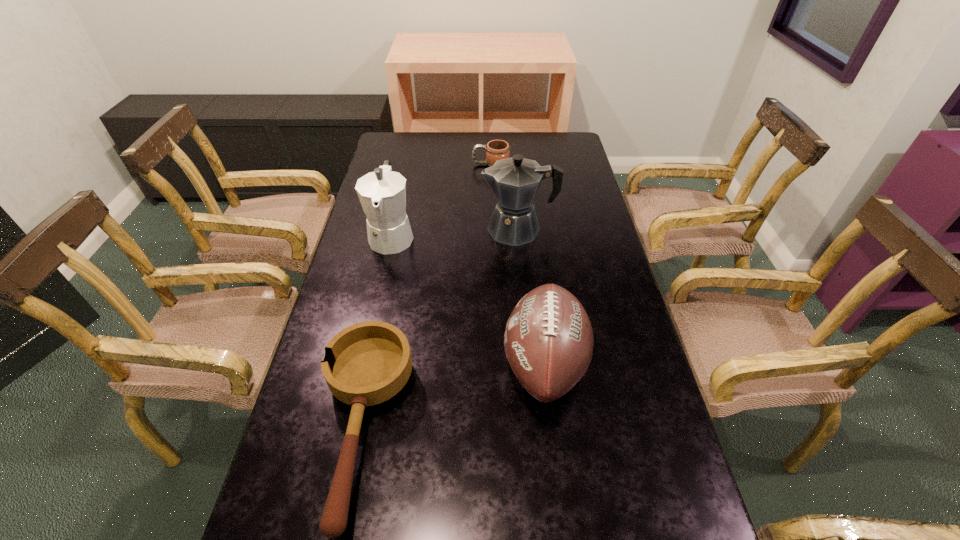
Where is `free space between the left coffeepot and the football (American)`? This screenshot has height=540, width=960. free space between the left coffeepot and the football (American) is located at coordinates (468, 299).

This screenshot has height=540, width=960. Identify the location of unoccupied position between the left coffeepot and the right coffeepot. (455, 232).

You are a GUI agent. You are given a task and a screenshot of the screen. Output one action in this format:
    pyautogui.click(x=<x>, y=<y>)
    Task: Click on the empty space between the right coffeepot and the left coffeepot
    Image resolution: width=960 pixels, height=540 pixels.
    Given the screenshot: What is the action you would take?
    (x=455, y=232)

Where is `free space between the left coffeepot and the farthest object`? free space between the left coffeepot and the farthest object is located at coordinates (442, 200).

Locate an element on the screen. This screenshot has height=540, width=960. object that can be found as the third closest to the left coffeepot is located at coordinates (496, 150).

Point out which object is positioned as the nearest to the right coffeepot. Please provide its 2D coordinates. Your answer should be formatted as a tuple, i.e. [(x, y)], where the tuple contains the x and y coordinates of a point satisfying the conditions above.

[(382, 193)]

Identify the location of free region that satisfies the following two spatial constraints: 1. at the spout of the right coffeepot; 2. at the spout of the left coffeepot. (518, 235).

The width and height of the screenshot is (960, 540). Identify the location of free location that satisfies the following two spatial constraints: 1. on the back side of the football (American); 2. at the spout of the right coffeepot. (528, 229).

The width and height of the screenshot is (960, 540). What are the coordinates of `free space that satisfies the following two spatial constraints: 1. on the side of the third shortest object with the handle; 2. on the left side of the mug` in the screenshot? It's located at pos(497,363).